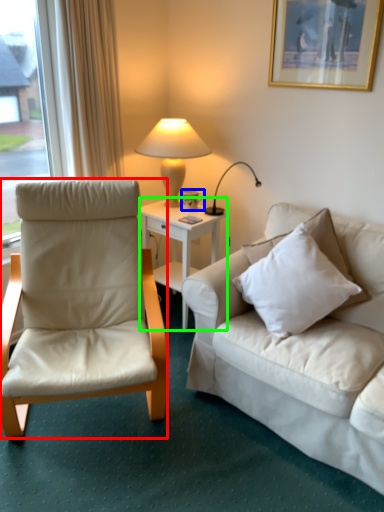
Question: Estimate the real-world distances between objects in this image. Which object is farther from chair (highlighted by a red box), coffee cup (highlighted by a blue box) or desk (highlighted by a green box)?

Choices:
 (A) coffee cup
 (B) desk

Answer: (A)